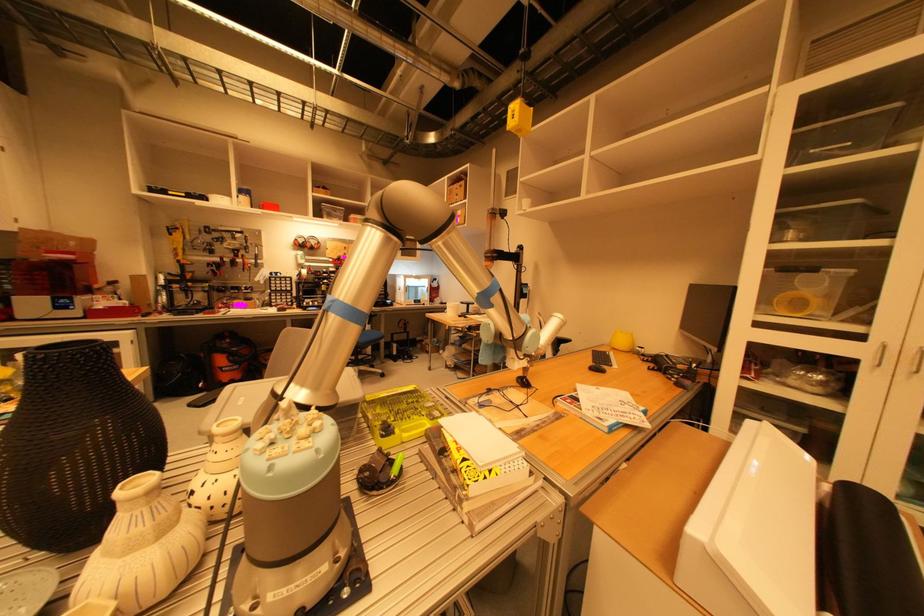
What are the coordinates of `tool case latch` in the screenshot? It's located at (212, 268).